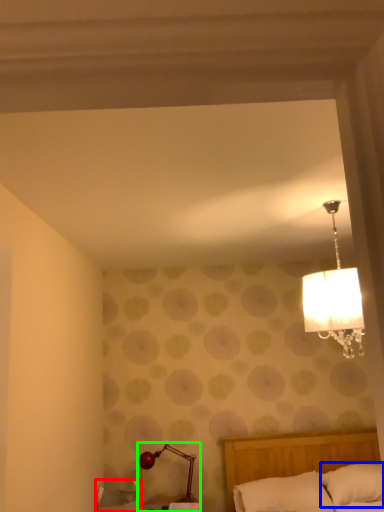
Question: Estimate the real-world distances between objects in this image. Which object is closer to furniture (highlighted by a red box), pillow (highlighted by a blue box) or lamp (highlighted by a green box)?

Choices:
 (A) pillow
 (B) lamp

Answer: (B)